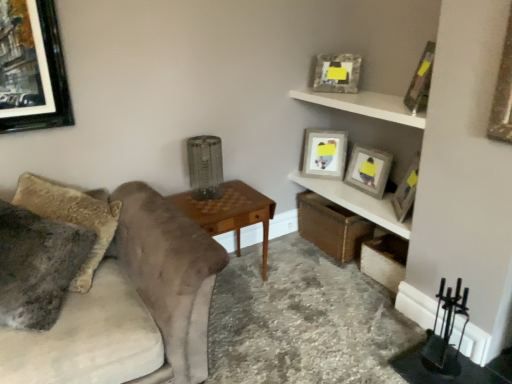
Locate an element on the screen. Image resolution: width=512 pixels, height=384 pixels. matte gray picture frame at upper right, acting as the 3th picture frame starting from the front is located at coordinates (369, 170).

What is the approximate width of woodenobject at center?

It is 17.28 inches.

This screenshot has height=384, width=512. What are the coordinates of `white matte shelf at upper right, which is the first shelf from top to bottom` in the screenshot? It's located at pos(366,105).

Measure the distance between wooden textured picture frame at upper right, marked as the 2th picture frame in a back-to-front arrangement, and camera.

wooden textured picture frame at upper right, marked as the 2th picture frame in a back-to-front arrangement, and camera are 2.75 meters apart.

The width and height of the screenshot is (512, 384). Identify the location of wooden picture frame at upper right, which appears as the second picture frame when viewed from the front. (406, 191).

Between velvet gray couch at left and matte gray picture frame at upper right, acting as the 3th picture frame starting from the front, which one has larger size?

velvet gray couch at left is bigger.

From a real-world perspective, relative to matte gray picture frame at upper right, acting as the 3th picture frame starting from the front, is velvet gray couch at left vertically above or below?

velvet gray couch at left is situated lower than matte gray picture frame at upper right, acting as the 3th picture frame starting from the front, in the real world.

Which of these two, velvet gray couch at left or matte gray picture frame at upper right, acting as the 3th picture frame starting from the front, is thinner?

matte gray picture frame at upper right, acting as the 3th picture frame starting from the front, is thinner.

Is velvet gray couch at left positioned beyond the bounds of matte gray picture frame at upper right, positioned as the third picture frame in back-to-front order?

Absolutely, velvet gray couch at left is external to matte gray picture frame at upper right, positioned as the third picture frame in back-to-front order.

Is wooden picture frame at upper right, which appears as the second picture frame when viewed from the front, in front of white matte shelf at upper right, which is the first shelf from top to bottom?

No.

Which is correct: wooden picture frame at upper right, the fourth picture frame positioned from the back, is inside white matte shelf at upper right, the second shelf in the bottom-to-top sequence, or outside of it?

wooden picture frame at upper right, the fourth picture frame positioned from the back, is located beyond the bounds of white matte shelf at upper right, the second shelf in the bottom-to-top sequence.

In the scene shown: Is there a large distance between wooden picture frame at upper right, the fourth picture frame positioned from the back, and white matte shelf at upper right, which is the first shelf from top to bottom?

Actually, wooden picture frame at upper right, the fourth picture frame positioned from the back, and white matte shelf at upper right, which is the first shelf from top to bottom, are a little close together.

Considering the relative sizes of wooden picture frame at upper right, which appears as the second picture frame when viewed from the front, and white matte shelf at upper right, which is the first shelf from top to bottom, in the image provided, is wooden picture frame at upper right, which appears as the second picture frame when viewed from the front, shorter than white matte shelf at upper right, which is the first shelf from top to bottom,?

No.

Does wooden shelf at upper right, the 2th shelf when ordered from top to bottom, appear on the right side of velvet gray couch at left?

Yes.

Considering the relative positions of wooden shelf at upper right, the 2th shelf when ordered from top to bottom, and velvet gray couch at left in the image provided, is wooden shelf at upper right, the 2th shelf when ordered from top to bottom, in front of velvet gray couch at left?

No, wooden shelf at upper right, the 2th shelf when ordered from top to bottom, is further to the viewer.

Is wooden shelf at upper right, positioned as the 1th shelf in bottom-to-top order, bigger than velvet gray couch at left?

Actually, wooden shelf at upper right, positioned as the 1th shelf in bottom-to-top order, might be smaller than velvet gray couch at left.

In the scene shown: Between wooden shelf at upper right, positioned as the 1th shelf in bottom-to-top order, and velvet gray couch at left, which one has less height?

wooden shelf at upper right, positioned as the 1th shelf in bottom-to-top order, is shorter.

This screenshot has height=384, width=512. Find the location of `the 2nd shelf above the velvet gray couch at left (from a real-world perspective)`. the 2nd shelf above the velvet gray couch at left (from a real-world perspective) is located at coordinates (366, 105).

Is velvet gray couch at left located within white matte shelf at upper right, the second shelf in the bottom-to-top sequence?

Definitely not — velvet gray couch at left is not inside white matte shelf at upper right, the second shelf in the bottom-to-top sequence.

Which is in front, white matte shelf at upper right, the second shelf in the bottom-to-top sequence, or velvet gray couch at left?

velvet gray couch at left is closer to the camera.

Where is `studio couch that appears in front of the woodenobject at center`? Image resolution: width=512 pixels, height=384 pixels. studio couch that appears in front of the woodenobject at center is located at coordinates (169, 273).

Is woodenobject at center far from velvet gray couch at left?

No, woodenobject at center is not far away from velvet gray couch at left.

Is woodenobject at center closer to camera compared to velvet gray couch at left?

No.

Is white matte shelf at upper right, the second shelf in the bottom-to-top sequence, looking in the opposite direction of wooden textured picture frame at upper right, which appears as the fourth picture frame when viewed from the front?

white matte shelf at upper right, the second shelf in the bottom-to-top sequence, is not turned away from wooden textured picture frame at upper right, which appears as the fourth picture frame when viewed from the front.

Who is bigger, white matte shelf at upper right, the second shelf in the bottom-to-top sequence, or wooden textured picture frame at upper right, marked as the 2th picture frame in a back-to-front arrangement?

With larger size is white matte shelf at upper right, the second shelf in the bottom-to-top sequence.

Is white matte shelf at upper right, which is the first shelf from top to bottom, completely or partially outside of wooden textured picture frame at upper right, which appears as the fourth picture frame when viewed from the front?

Yes, white matte shelf at upper right, which is the first shelf from top to bottom, is not within wooden textured picture frame at upper right, which appears as the fourth picture frame when viewed from the front.

Does point (327, 98) come in front of point (348, 75)?

Yes, it is.

Considering the sizes of wooden textured picture frame at upper right, marked as the 2th picture frame in a back-to-front arrangement, and woodenobject at center in the image, is wooden textured picture frame at upper right, marked as the 2th picture frame in a back-to-front arrangement, taller or shorter than woodenobject at center?

Considering their sizes, wooden textured picture frame at upper right, marked as the 2th picture frame in a back-to-front arrangement, has less height than woodenobject at center.

Is wooden textured picture frame at upper right, marked as the 2th picture frame in a back-to-front arrangement, wider than woodenobject at center?

In fact, wooden textured picture frame at upper right, marked as the 2th picture frame in a back-to-front arrangement, might be narrower than woodenobject at center.

Which is in front, wooden textured picture frame at upper right, marked as the 2th picture frame in a back-to-front arrangement, or woodenobject at center?

woodenobject at center.

Measure the distance from wooden textured picture frame at upper right, which appears as the fourth picture frame when viewed from the front, to woodenobject at center.

They are 1.05 meters apart.

Where is `studio couch that appears in front of the matte gray picture frame at upper right, acting as the 3th picture frame starting from the front`? studio couch that appears in front of the matte gray picture frame at upper right, acting as the 3th picture frame starting from the front is located at coordinates click(x=169, y=273).

Where is `the 2nd picture frame below the white matte shelf at upper right, the second shelf in the bottom-to-top sequence (from a real-world perspective)`? The width and height of the screenshot is (512, 384). the 2nd picture frame below the white matte shelf at upper right, the second shelf in the bottom-to-top sequence (from a real-world perspective) is located at coordinates (406, 191).

Looking at the image, which one is located further to fuzzy fabric pillow at left, matte gray picture frame at upper right, the first picture frame in the back-to-front sequence, or matte gray picture frame at upper right, positioned as the third picture frame in back-to-front order?

matte gray picture frame at upper right, positioned as the third picture frame in back-to-front order, is further to fuzzy fabric pillow at left.

Looking at the image, which one is located further to wooden shelf at upper right, the 2th shelf when ordered from top to bottom, fuzzy fabric pillow at left or wooden picture frame at upper right, the fourth picture frame positioned from the back?

fuzzy fabric pillow at left is positioned further to the anchor wooden shelf at upper right, the 2th shelf when ordered from top to bottom.

Looking at the image, which one is located closer to white matte shelf at upper right, the second shelf in the bottom-to-top sequence, matte gray picture frame at upper right, acting as the 3th picture frame starting from the front, or wooden picture frame at upper right, the fourth picture frame positioned from the back?

The object closer to white matte shelf at upper right, the second shelf in the bottom-to-top sequence, is matte gray picture frame at upper right, acting as the 3th picture frame starting from the front.

Considering their positions, is woodenobject at center positioned closer to matte gray picture frame at upper right, positioned as the third picture frame in back-to-front order, than wooden picture frame at upper right, positioned as the 1th picture frame in front-to-back order?

wooden picture frame at upper right, positioned as the 1th picture frame in front-to-back order, lies closer to matte gray picture frame at upper right, positioned as the third picture frame in back-to-front order, than the other object.

From the image, which object appears to be nearer to wooden shelf at upper right, the 2th shelf when ordered from top to bottom, woodenobject at center or wooden textured picture frame at upper right, which appears as the fourth picture frame when viewed from the front?

woodenobject at center lies closer to wooden shelf at upper right, the 2th shelf when ordered from top to bottom, than the other object.

Based on their spatial positions, is wooden shelf at upper right, positioned as the 1th shelf in bottom-to-top order, or wooden picture frame at upper right, positioned as the 1th picture frame in front-to-back order, closer to white matte shelf at upper right, the second shelf in the bottom-to-top sequence?

wooden picture frame at upper right, positioned as the 1th picture frame in front-to-back order, lies closer to white matte shelf at upper right, the second shelf in the bottom-to-top sequence, than the other object.

Looking at the image, which one is located closer to wooden shelf at upper right, positioned as the 1th shelf in bottom-to-top order, velvet gray couch at left or white matte shelf at upper right, which is the first shelf from top to bottom?

white matte shelf at upper right, which is the first shelf from top to bottom, lies closer to wooden shelf at upper right, positioned as the 1th shelf in bottom-to-top order, than the other object.

In the scene shown: Based on their spatial positions, is velvet gray couch at left or matte gray picture frame at upper right, the first picture frame in the back-to-front sequence, further from woodenobject at center?

Result: Based on the image, matte gray picture frame at upper right, the first picture frame in the back-to-front sequence, appears to be further to woodenobject at center.

Where is `shelf situated between fuzzy fabric pillow at left and wooden shelf at upper right, positioned as the 1th shelf in bottom-to-top order, from left to right`? The width and height of the screenshot is (512, 384). shelf situated between fuzzy fabric pillow at left and wooden shelf at upper right, positioned as the 1th shelf in bottom-to-top order, from left to right is located at coordinates (366, 105).

Find the location of a particular element. table situated between velvet gray couch at left and white matte shelf at upper right, the second shelf in the bottom-to-top sequence, from left to right is located at coordinates (230, 213).

The height and width of the screenshot is (384, 512). Identify the location of table between fuzzy fabric pillow at left and wooden shelf at upper right, positioned as the 1th shelf in bottom-to-top order. (230, 213).

Locate an element on the screen. studio couch between fuzzy fabric pillow at left and wooden textured picture frame at upper right, marked as the 2th picture frame in a back-to-front arrangement is located at coordinates (169, 273).